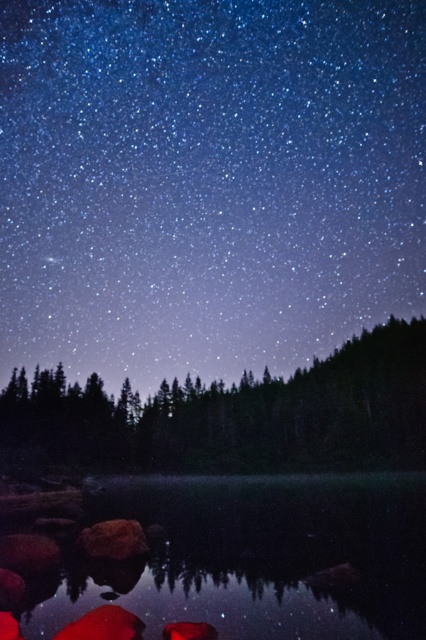
Question: Which point is closer to the camera?

Choices:
 (A) transparent water at center
 (B) dark green textured trees at center

Answer: (A)

Question: Can you confirm if transparent water at center is positioned above dark green textured trees at center?

Choices:
 (A) yes
 (B) no

Answer: (A)

Question: Among these objects, which one is nearest to the camera?

Choices:
 (A) dark green textured trees at center
 (B) transparent water at center

Answer: (B)

Question: Can you confirm if transparent water at center is smaller than dark green textured trees at center?

Choices:
 (A) no
 (B) yes

Answer: (B)

Question: In this image, where is transparent water at center located relative to dark green textured trees at center?

Choices:
 (A) right
 (B) left

Answer: (B)